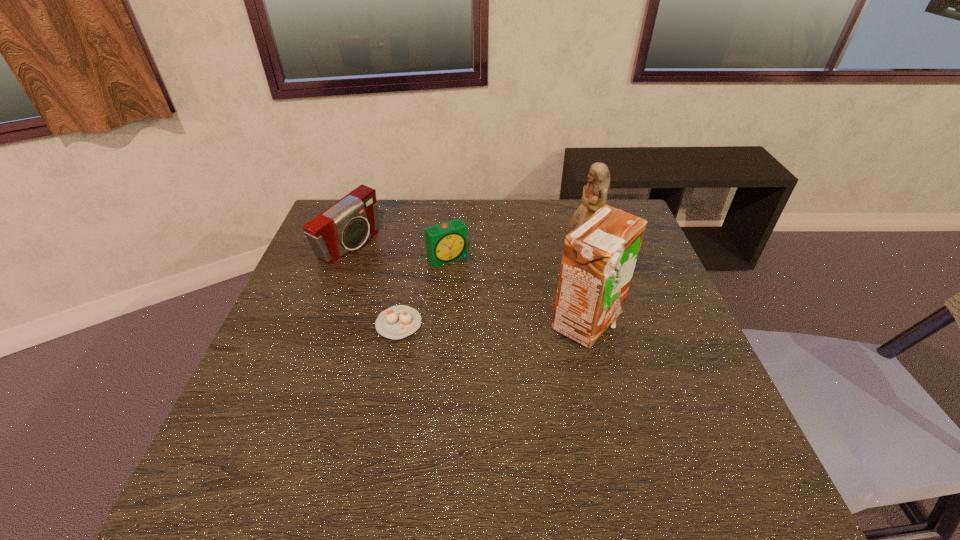
I want to click on blank space located 0.090m on the front-facing side of the second shortest object, so click(471, 286).

The height and width of the screenshot is (540, 960). I want to click on vacant space located 0.220m on the front-facing side of the figurine, so click(530, 300).

Image resolution: width=960 pixels, height=540 pixels. In order to click on free location located on the front-facing side of the figurine in this screenshot , I will do `click(526, 305)`.

This screenshot has height=540, width=960. I want to click on vacant space located 0.400m on the front-facing side of the figurine, so click(490, 343).

You are a GUI agent. You are given a task and a screenshot of the screen. Output one action in this format:
    pyautogui.click(x=<x>, y=<y>)
    Task: Click on the free space located on the front-facing side of the camera
    This screenshot has height=540, width=960.
    Given the screenshot: What is the action you would take?
    pyautogui.click(x=475, y=314)

The image size is (960, 540). I want to click on vacant region located on the front-facing side of the camera, so click(x=420, y=286).

Locate an element on the screen. The height and width of the screenshot is (540, 960). vacant space located 0.320m on the front-facing side of the camera is located at coordinates (456, 304).

You are a GUI agent. You are given a task and a screenshot of the screen. Output one action in this format:
    pyautogui.click(x=<x>, y=<y>)
    Task: Click on the figurine that is positioned at the far edge
    The image size is (960, 540).
    Given the screenshot: What is the action you would take?
    pyautogui.click(x=594, y=197)

Image resolution: width=960 pixels, height=540 pixels. Find the location of `camera situated at the far edge`. camera situated at the far edge is located at coordinates (345, 226).

Image resolution: width=960 pixels, height=540 pixels. I want to click on object at the left edge, so click(x=345, y=226).